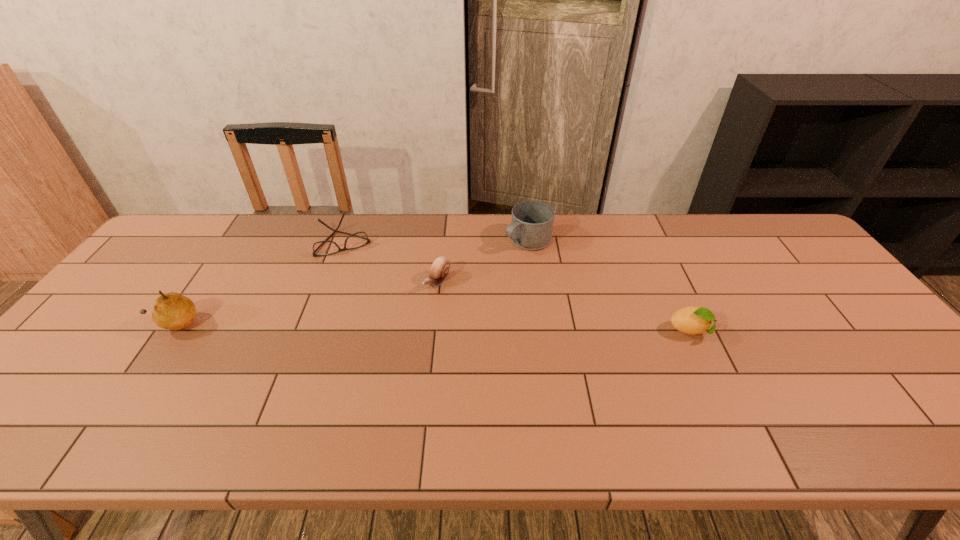
The width and height of the screenshot is (960, 540). In order to click on empty space between the third object from left to right and the rightmost object in this screenshot , I will do `click(564, 307)`.

Find the location of a particular element. empty space that is in between the escargot and the spectacles is located at coordinates (391, 261).

What are the coordinates of `empty location between the third object from right to left and the mug` in the screenshot? It's located at tap(482, 261).

Locate an element on the screen. unoccupied position between the second object from right to left and the shortest object is located at coordinates (436, 240).

This screenshot has height=540, width=960. In order to click on vacant area that lies between the escargot and the pear in this screenshot , I will do `click(305, 303)`.

I want to click on vacant space in between the lemon and the escargot, so click(564, 307).

The image size is (960, 540). I want to click on vacant space in between the rightmost object and the fourth object from left to right, so click(x=609, y=286).

Point out which object is positioned as the third nearest to the pear. Please provide its 2D coordinates. Your answer should be formatted as a tuple, i.e. [(x, y)], where the tuple contains the x and y coordinates of a point satisfying the conditions above.

[(531, 228)]

Locate an element on the screen. The height and width of the screenshot is (540, 960). object that is the closest to the fourth object from left to right is located at coordinates [439, 270].

Where is `vacant region that satisfies the following two spatial constraints: 1. on the front side of the rightmost object; 2. with leaves positioned above the mug`? The width and height of the screenshot is (960, 540). vacant region that satisfies the following two spatial constraints: 1. on the front side of the rightmost object; 2. with leaves positioned above the mug is located at coordinates (540, 332).